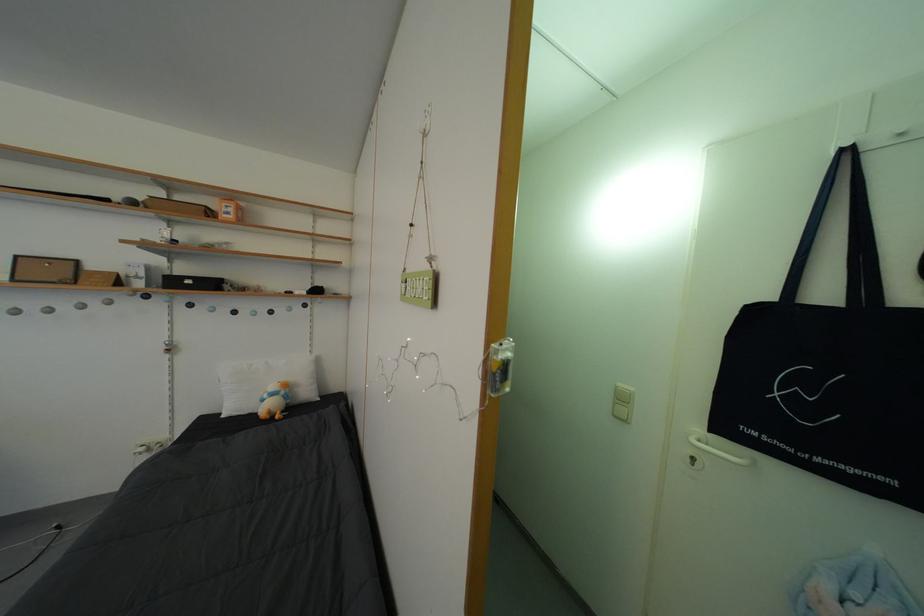
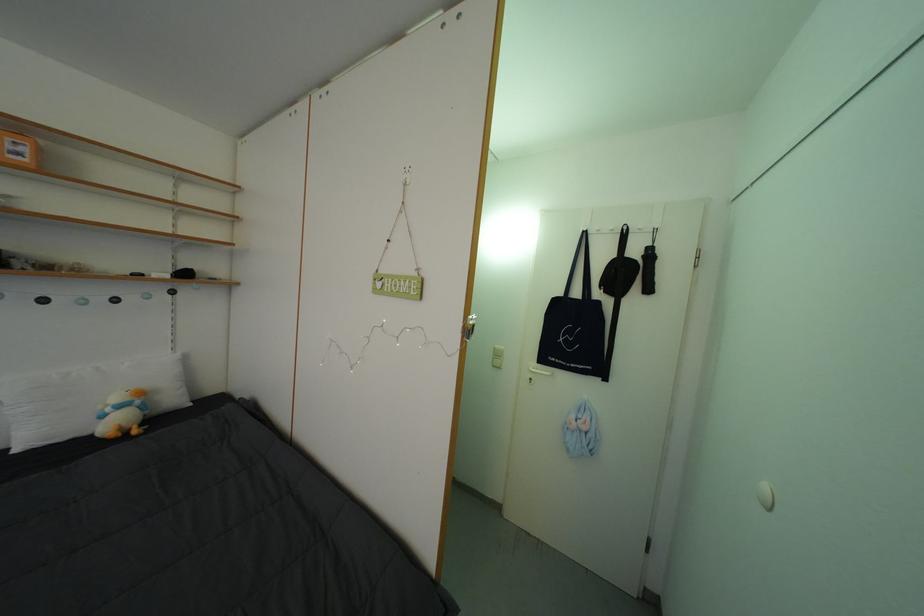
Find the pixel in the second image that matches the point at 833,300 in the first image.

(586, 300)